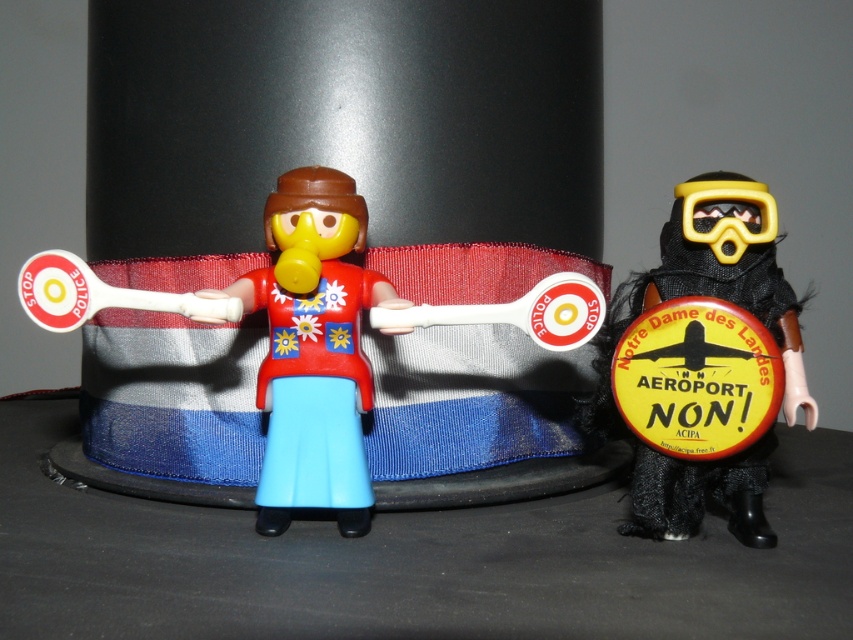
Question: Can you confirm if matte plastic figure at center is positioned to the left of black fabric mask at right?

Choices:
 (A) yes
 (B) no

Answer: (A)

Question: Among these points, which one is nearest to the camera?

Choices:
 (A) (312, 326)
 (B) (671, 266)

Answer: (A)

Question: Does matte plastic toy at center have a greater width compared to black fabric mask at right?

Choices:
 (A) no
 (B) yes

Answer: (B)

Question: Does matte plastic toy at center come in front of black fabric mask at right?

Choices:
 (A) yes
 (B) no

Answer: (B)

Question: Which object appears closest to the camera in this image?

Choices:
 (A) black fabric mask at right
 (B) matte plastic toy at center

Answer: (A)

Question: Which point is farther to the camera?

Choices:
 (A) (338, 460)
 (B) (282, 193)
 (C) (610, 333)

Answer: (C)